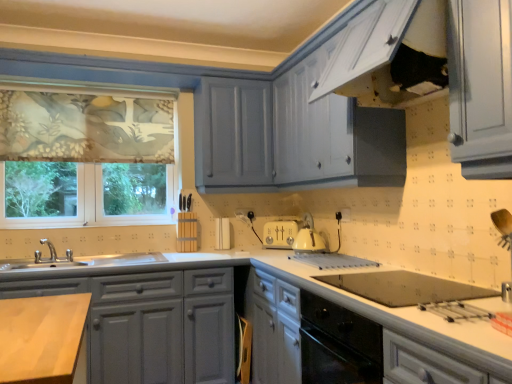
Question: Are matte gray cabinets at lower left, placed as the first cabinetry when sorted from left to right, and floral fabric window at left located far from each other?

Choices:
 (A) yes
 (B) no

Answer: (A)

Question: Would you say matte gray cabinets at lower left, placed as the first cabinetry when sorted from left to right, contains floral fabric window at left?

Choices:
 (A) yes
 (B) no

Answer: (B)

Question: Does matte gray cabinets at lower left, placed as the first cabinetry when sorted from left to right, have a lesser height compared to floral fabric window at left?

Choices:
 (A) yes
 (B) no

Answer: (A)

Question: Does matte gray cabinets at lower left, placed as the first cabinetry when sorted from left to right, appear on the left side of floral fabric window at left?

Choices:
 (A) no
 (B) yes

Answer: (A)

Question: Is matte gray cabinets at lower left, which ranks as the 2th cabinetry in right-to-left order, at the right side of floral fabric window at left?

Choices:
 (A) no
 (B) yes

Answer: (B)

Question: Is matte gray cabinets at lower left, which ranks as the 2th cabinetry in right-to-left order, further to camera compared to floral fabric window at left?

Choices:
 (A) yes
 (B) no

Answer: (B)

Question: Can you confirm if floral fabric window at left is positioned to the right of matte gray cabinets at lower left, placed as the first cabinetry when sorted from left to right?

Choices:
 (A) yes
 (B) no

Answer: (B)

Question: Is floral fabric window at left further to the viewer compared to matte gray cabinets at lower left, which ranks as the 2th cabinetry in right-to-left order?

Choices:
 (A) yes
 (B) no

Answer: (A)

Question: Are floral fabric window at left and matte gray cabinets at lower left, which ranks as the 2th cabinetry in right-to-left order, far apart?

Choices:
 (A) no
 (B) yes

Answer: (B)

Question: Is floral fabric window at left next to matte gray cabinets at lower left, placed as the first cabinetry when sorted from left to right, and touching it?

Choices:
 (A) no
 (B) yes

Answer: (A)

Question: Could you tell me if floral fabric window at left is facing matte gray cabinets at lower left, which ranks as the 2th cabinetry in right-to-left order?

Choices:
 (A) no
 (B) yes

Answer: (A)

Question: From a real-world perspective, is floral fabric window at left located beneath matte gray cabinets at lower left, placed as the first cabinetry when sorted from left to right?

Choices:
 (A) yes
 (B) no

Answer: (B)

Question: Does matte gray cabinets at lower left, placed as the first cabinetry when sorted from left to right, appear on the right side of white glossy oven at lower center, which ranks as the 1th cabinetry in right-to-left order?

Choices:
 (A) no
 (B) yes

Answer: (A)